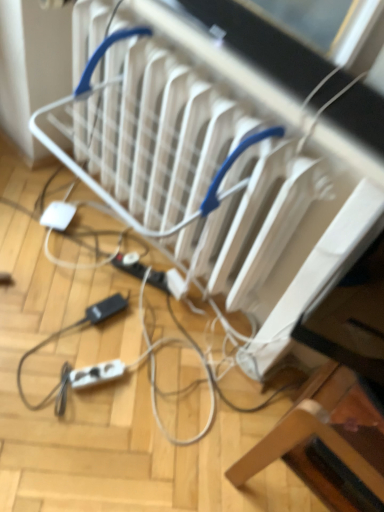
Question: Does white plastic extension cord at lower left, which is counted as the 2th extension cord, starting from the top, have a lesser width compared to white plastic extension cord at lower center, the first extension cord in the back-to-front sequence?

Choices:
 (A) yes
 (B) no

Answer: (B)

Question: Is white plastic extension cord at lower left, which ranks as the 1th extension cord in bottom-to-top order, with white plastic extension cord at lower center, which is counted as the second extension cord, starting from the bottom?

Choices:
 (A) yes
 (B) no

Answer: (B)

Question: From a real-world perspective, is white plastic extension cord at lower left, placed as the 1th extension cord when sorted from front to back, located beneath white plastic extension cord at lower center, the 1th extension cord when ordered from top to bottom?

Choices:
 (A) yes
 (B) no

Answer: (A)

Question: Is white plastic extension cord at lower center, which is counted as the second extension cord, starting from the bottom, at the back of white plastic extension cord at lower left, placed as the 1th extension cord when sorted from front to back?

Choices:
 (A) yes
 (B) no

Answer: (A)

Question: Can you confirm if white plastic extension cord at lower left, which ranks as the 1th extension cord in bottom-to-top order, is shorter than white plastic extension cord at lower center, the 1th extension cord when ordered from top to bottom?

Choices:
 (A) no
 (B) yes

Answer: (A)

Question: Considering the relative sizes of white plastic extension cord at lower left, which is counted as the 2th extension cord, starting from the top, and white plastic extension cord at lower center, which is counted as the second extension cord, starting from the bottom, in the image provided, is white plastic extension cord at lower left, which is counted as the 2th extension cord, starting from the top, wider than white plastic extension cord at lower center, which is counted as the second extension cord, starting from the bottom,?

Choices:
 (A) no
 (B) yes

Answer: (B)

Question: Considering the relative sizes of wooden chair at lower right and white plastic extension cord at lower center, the 1th extension cord when ordered from top to bottom, in the image provided, is wooden chair at lower right taller than white plastic extension cord at lower center, the 1th extension cord when ordered from top to bottom,?

Choices:
 (A) no
 (B) yes

Answer: (B)

Question: Would you consider wooden chair at lower right to be distant from white plastic extension cord at lower center, which is counted as the second extension cord, starting from the bottom?

Choices:
 (A) yes
 (B) no

Answer: (B)

Question: From a real-world perspective, is wooden chair at lower right located higher than white plastic extension cord at lower center, arranged as the 2th extension cord when viewed from the front?

Choices:
 (A) yes
 (B) no

Answer: (A)

Question: Is wooden chair at lower right aimed at white plastic extension cord at lower center, arranged as the 2th extension cord when viewed from the front?

Choices:
 (A) yes
 (B) no

Answer: (B)

Question: From a real-world perspective, is wooden chair at lower right beneath white plastic extension cord at lower center, which is counted as the second extension cord, starting from the bottom?

Choices:
 (A) yes
 (B) no

Answer: (B)

Question: Can you confirm if wooden chair at lower right is wider than white plastic extension cord at lower center, arranged as the 2th extension cord when viewed from the front?

Choices:
 (A) yes
 (B) no

Answer: (A)

Question: Is white plastic extension cord at lower left, which is counted as the 2th extension cord, starting from the top, shorter than white plastic radiator at center?

Choices:
 (A) yes
 (B) no

Answer: (A)